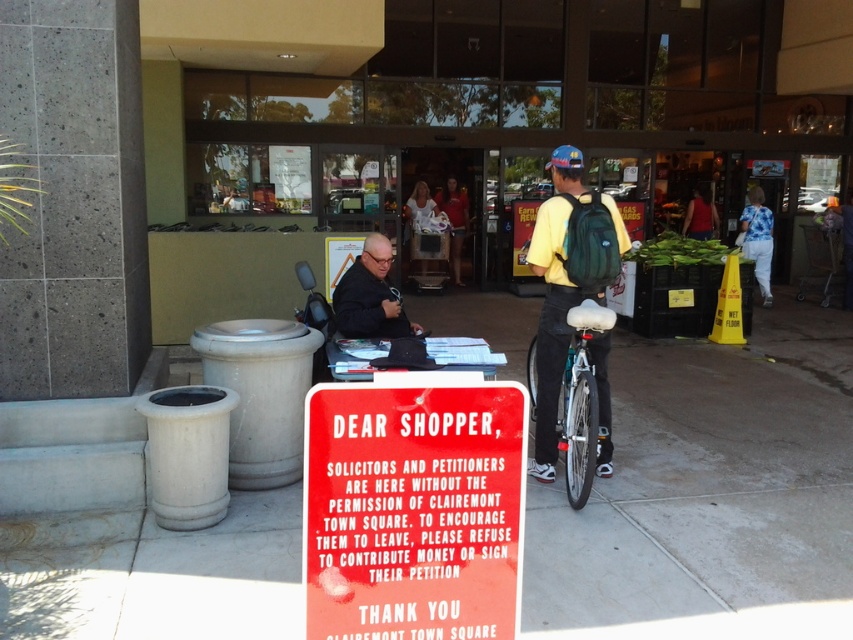
You are a delivery person who needs to secure your white matte bicycle at center to a rack. However, there is a green fabric backpack at right in the way. Can you move the backpack to access the rack?

The green fabric backpack at right is positioned over the white matte bicycle at center, so you cannot access the rack without moving the backpack first.

You are standing in front of the red sign at the shopping center. You notice two points marked in the scene. Which point is closer to you, point at coordinates (x=560, y=304) or point at coordinates (x=585, y=492)?

Point at coordinates (x=560, y=304) is closer to you because it is further to the camera than point at coordinates (x=585, y=492).

You are a fashion designer observing two shirts displayed at the center of a plaza. Which shirt would require less fabric to produce, the white cotton shirt at center or the matte red shirt at center?

The white cotton shirt at center is thinner than the matte red shirt at center, so it would require less fabric to produce.